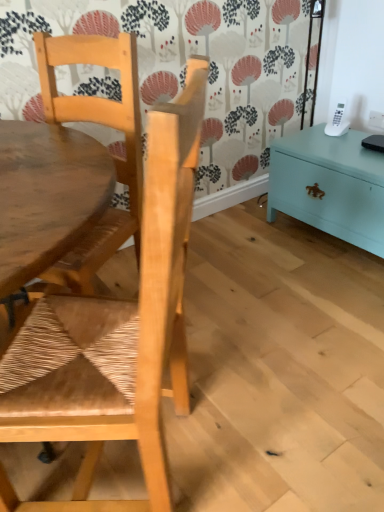
Question: Is white plastic power outlet at upper right inside the boundaries of teal painted wood chest at right, or outside?

Choices:
 (A) inside
 (B) outside

Answer: (B)

Question: From the image's perspective, is white plastic power outlet at upper right located above or below teal painted wood chest at right?

Choices:
 (A) below
 (B) above

Answer: (B)

Question: Estimate the real-world distances between objects in this image. Which object is farther from the natural wood chair at left, the 1th chair ordered from the bottom?

Choices:
 (A) teal painted wood chest at right
 (B) natural wood chair at upper left, the first chair when ordered from top to bottom
 (C) white plastic power outlet at upper right

Answer: (C)

Question: Which object is the farthest from the white plastic power outlet at upper right?

Choices:
 (A) natural wood chair at left, positioned as the 2th chair in top-to-bottom order
 (B) natural wood chair at upper left, the first chair when ordered from top to bottom
 (C) teal painted wood chest at right

Answer: (A)